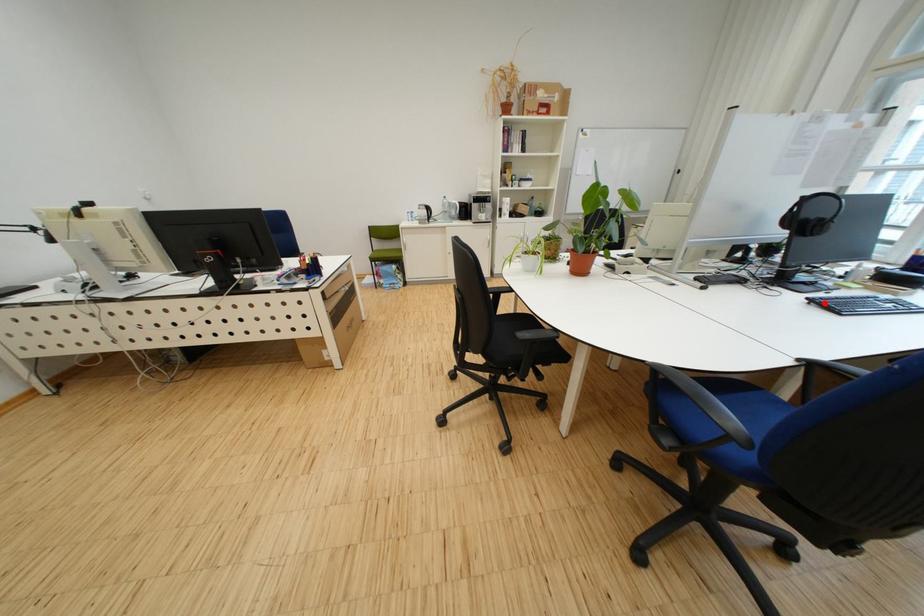
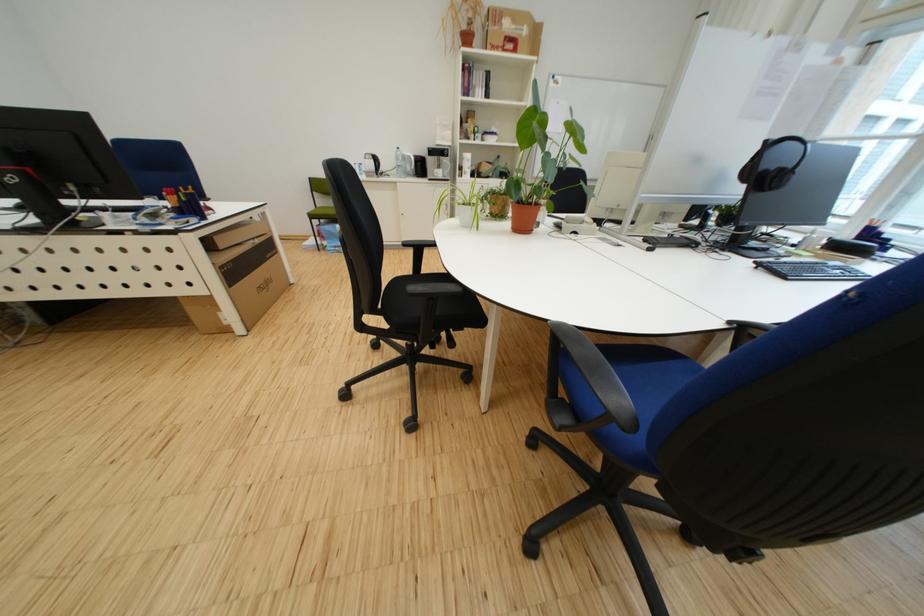
In the second image, find the point that corresponds to the highlighted location in the first image.

(772, 268)